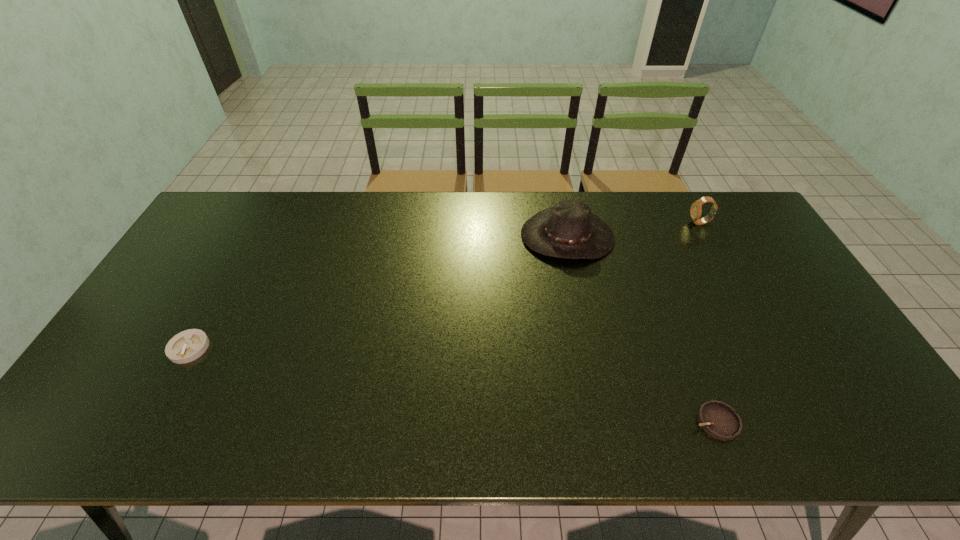
Identify the location of free location located on the right of the farther ashtray. (288, 348).

Find the location of a particular element. Image resolution: width=960 pixels, height=540 pixels. vacant position located 0.080m on the back of the nearer ashtray is located at coordinates (697, 374).

The height and width of the screenshot is (540, 960). Identify the location of hat that is at the far edge. (568, 230).

Find the location of `watch situated at the far edge`. watch situated at the far edge is located at coordinates (696, 208).

The image size is (960, 540). Find the location of `object located at the near edge`. object located at the near edge is located at coordinates (718, 419).

This screenshot has height=540, width=960. In order to click on object that is at the left edge in this screenshot , I will do `click(186, 346)`.

At what (x,y) coordinates should I click in order to perform the action: click on object present at the right edge. Please return your answer as a coordinate pair (x, y). Image resolution: width=960 pixels, height=540 pixels. Looking at the image, I should click on (696, 208).

Identify the location of object at the far right corner. The width and height of the screenshot is (960, 540). tap(696, 208).

You are a GUI agent. You are given a task and a screenshot of the screen. Output one action in this format:
    pyautogui.click(x=<x>, y=<y>)
    Task: Click on the vacant space at the far edge
    The width and height of the screenshot is (960, 540).
    Given the screenshot: What is the action you would take?
    pyautogui.click(x=476, y=192)

The height and width of the screenshot is (540, 960). In the image, there is a desktop. In order to click on vacant space at the left edge in this screenshot , I will do tap(182, 278).